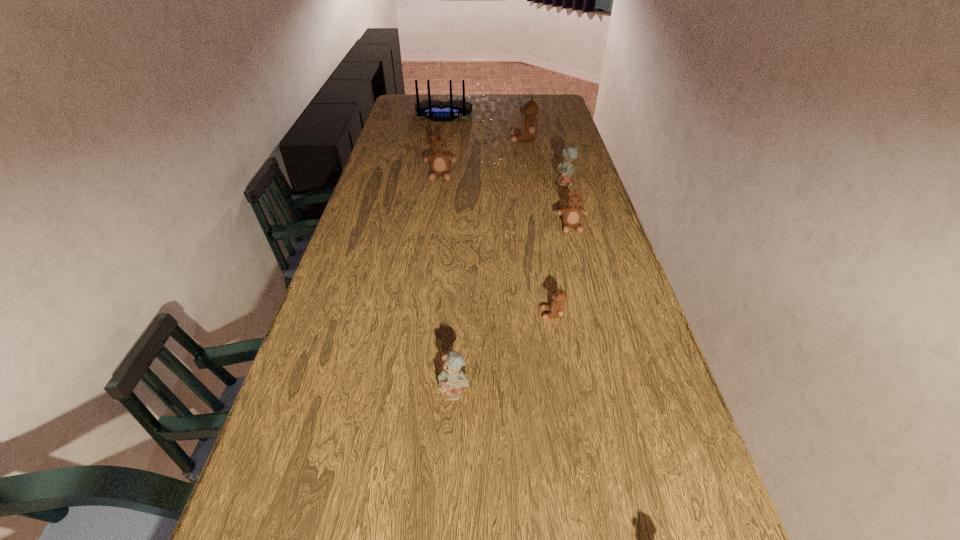
I want to click on free space located 0.140m on the front-facing side of the right blue teddy bear, so click(x=517, y=184).

Locate an element on the screen. Image resolution: width=960 pixels, height=540 pixels. vacant area situated 0.260m on the front-facing side of the leftmost brown teddy bear is located at coordinates (434, 223).

This screenshot has width=960, height=540. I want to click on free space located 0.200m on the front-facing side of the third nearest teddy bear, so pos(585,277).

At what (x,y) coordinates should I click in order to perform the action: click on blank space located 0.200m on the front-facing side of the nearer blue teddy bear. Please return your answer as a coordinate pair (x, y). The height and width of the screenshot is (540, 960). Looking at the image, I should click on (449, 499).

At what (x,y) coordinates should I click in order to perform the action: click on vacant space located 0.180m on the front-facing side of the shortest object. Please return your answer as a coordinate pair (x, y). Image resolution: width=960 pixels, height=540 pixels. Looking at the image, I should click on (471, 314).

Locate an element on the screen. This screenshot has height=540, width=960. vacant point located 0.110m on the front-facing side of the shortest object is located at coordinates (498, 314).

This screenshot has width=960, height=540. Find the location of `free space located on the front-facing side of the shortest object`. free space located on the front-facing side of the shortest object is located at coordinates (460, 314).

The image size is (960, 540). Find the location of `object that is at the far edge`. object that is at the far edge is located at coordinates (435, 110).

The image size is (960, 540). I want to click on object that is at the left edge, so click(435, 110).

You are a GUI agent. You are given a task and a screenshot of the screen. Output one action in this format:
    pyautogui.click(x=<x>, y=<y>)
    Task: Click on the object situated at the far left corner
    The image size is (960, 540).
    Given the screenshot: What is the action you would take?
    pyautogui.click(x=435, y=110)